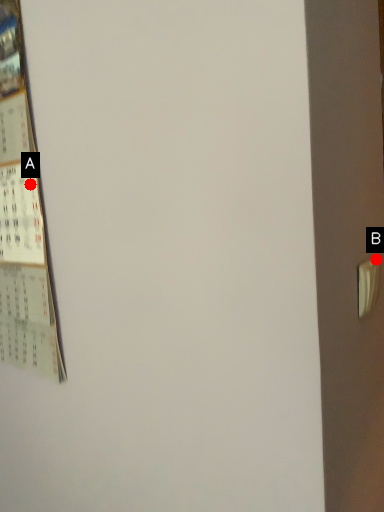
Question: Two points are circled on the image, labeled by A and B beside each circle. Which of the following is the closest to the observer?

Choices:
 (A) A is closer
 (B) B is closer

Answer: (B)